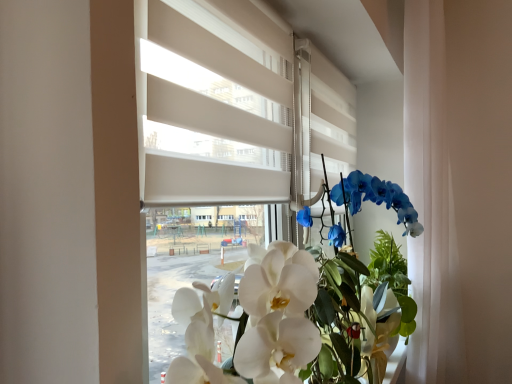
This screenshot has height=384, width=512. Describe the element at coordinates (430, 200) in the screenshot. I see `white sheer curtain at right` at that location.

The height and width of the screenshot is (384, 512). Describe the element at coordinates (295, 319) in the screenshot. I see `white glossy orchid at center` at that location.

Locate an element on the screen. white glossy orchid at center is located at coordinates click(x=295, y=319).

I want to click on white matte blinds at center, so click(x=212, y=111).

From a real-world perspective, is white matte blinds at center physically below white glossy orchid at center?

No.

Is white matte blinds at center not within white glossy orchid at center?

white matte blinds at center lies outside white glossy orchid at center's area.

From the image's perspective, which is below, white sheer curtain at right or white matte blinds at center?

white sheer curtain at right.

From a real-world perspective, is white sheer curtain at right beneath white matte blinds at center?

Indeed, from a real-world perspective, white sheer curtain at right is positioned beneath white matte blinds at center.

Is white sheer curtain at right touching white matte blinds at center?

white sheer curtain at right and white matte blinds at center are clearly separated.

Considering the sizes of objects white sheer curtain at right and white matte blinds at center in the image provided, who is smaller, white sheer curtain at right or white matte blinds at center?

white matte blinds at center.

Considering the sizes of white glossy orchid at center and white matte blinds at center in the image, is white glossy orchid at center bigger or smaller than white matte blinds at center?

In the image, white glossy orchid at center appears to be larger than white matte blinds at center.

In the scene shown: Which of these two, white glossy orchid at center or white matte blinds at center, stands taller?

Standing taller between the two is white matte blinds at center.

Based on the photo, from the image's perspective, is white glossy orchid at center located beneath white matte blinds at center?

Yes, from the image's perspective, white glossy orchid at center is beneath white matte blinds at center.

Is white glossy orchid at center at the right side of white matte blinds at center?

Yes.

From a real-world perspective, which is physically above, white matte blinds at center or white sheer curtain at right?

In real-world perspective, white matte blinds at center is above.

Is white matte blinds at center to the left or to the right of white sheer curtain at right in the image?

white matte blinds at center is positioned on white sheer curtain at right's left side.

Is white matte blinds at center far from white sheer curtain at right?

No, white matte blinds at center is not far from white sheer curtain at right.

Is white sheer curtain at right positioned behind white glossy orchid at center?

Yes, the depth of white sheer curtain at right is greater than that of white glossy orchid at center.

Is white sheer curtain at right facing towards white glossy orchid at center?

No, white sheer curtain at right is not aimed at white glossy orchid at center.

Is white sheer curtain at right with white glossy orchid at center?

They are not placed beside each other.

How many degrees apart are the facing directions of white sheer curtain at right and white glossy orchid at center?

The angle between the facing direction of white sheer curtain at right and the facing direction of white glossy orchid at center is 3.57 degrees.

Could you tell me if white glossy orchid at center is turned towards white sheer curtain at right?

No, white glossy orchid at center is not facing towards white sheer curtain at right.

Find the location of a particular element. This screenshot has height=384, width=512. curtain above the white glossy orchid at center (from the image's perspective) is located at coordinates (430, 200).

Is white glossy orchid at center to the left of white sheer curtain at right from the viewer's perspective?

Correct, you'll find white glossy orchid at center to the left of white sheer curtain at right.

In terms of height, does white glossy orchid at center look taller or shorter compared to white sheer curtain at right?

Clearly, white glossy orchid at center is shorter compared to white sheer curtain at right.

Where is `blind above the white glossy orchid at center (from the image's perspective)`? blind above the white glossy orchid at center (from the image's perspective) is located at coordinates (212, 111).

I want to click on curtain directly beneath the white matte blinds at center (from a real-world perspective), so click(x=430, y=200).

Estimate the real-world distances between objects in this image. Which object is closer to white sheer curtain at right, white glossy orchid at center or white matte blinds at center?

The object closer to white sheer curtain at right is white glossy orchid at center.

From the image, which object appears to be nearer to white glossy orchid at center, white matte blinds at center or white sheer curtain at right?

The object closer to white glossy orchid at center is white sheer curtain at right.

From the image, which object appears to be nearer to white glossy orchid at center, white sheer curtain at right or white matte blinds at center?

The object closer to white glossy orchid at center is white sheer curtain at right.

When comparing their distances from white matte blinds at center, does white glossy orchid at center or white sheer curtain at right seem closer?

white glossy orchid at center.

Looking at the image, which one is located further to white sheer curtain at right, white matte blinds at center or white glossy orchid at center?

The object further to white sheer curtain at right is white matte blinds at center.

Looking at the image, which one is located further to white matte blinds at center, white sheer curtain at right or white glossy orchid at center?

Based on the image, white sheer curtain at right appears to be further to white matte blinds at center.

The width and height of the screenshot is (512, 384). I want to click on floral arrangement between white matte blinds at center and white sheer curtain at right from front to back, so click(295, 319).